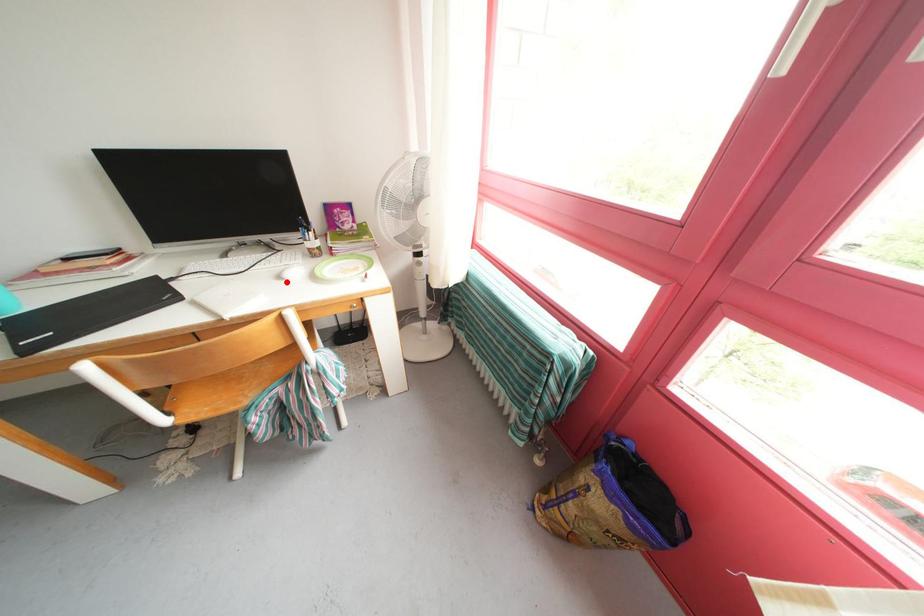
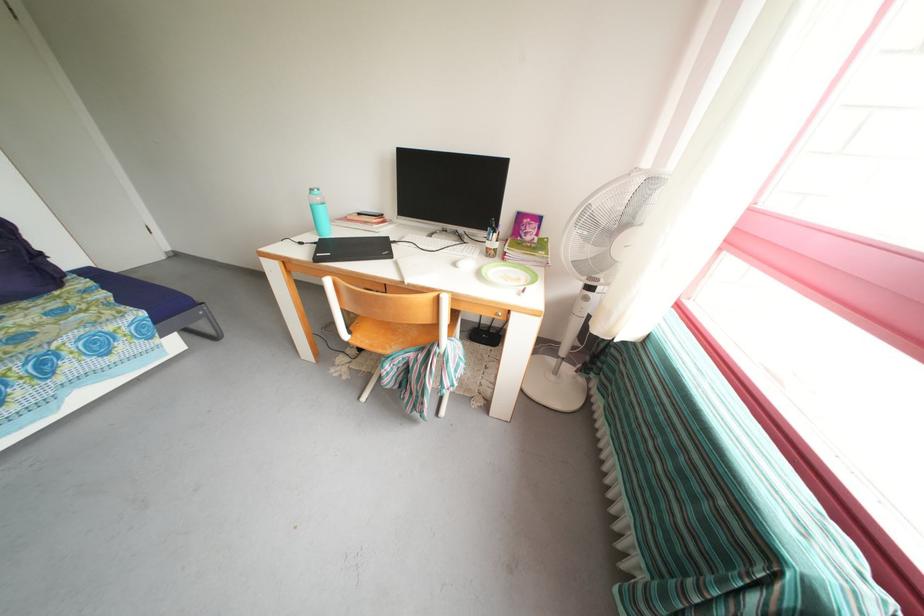
In the second image, find the point that corresponds to the highlighted location in the first image.

(462, 269)